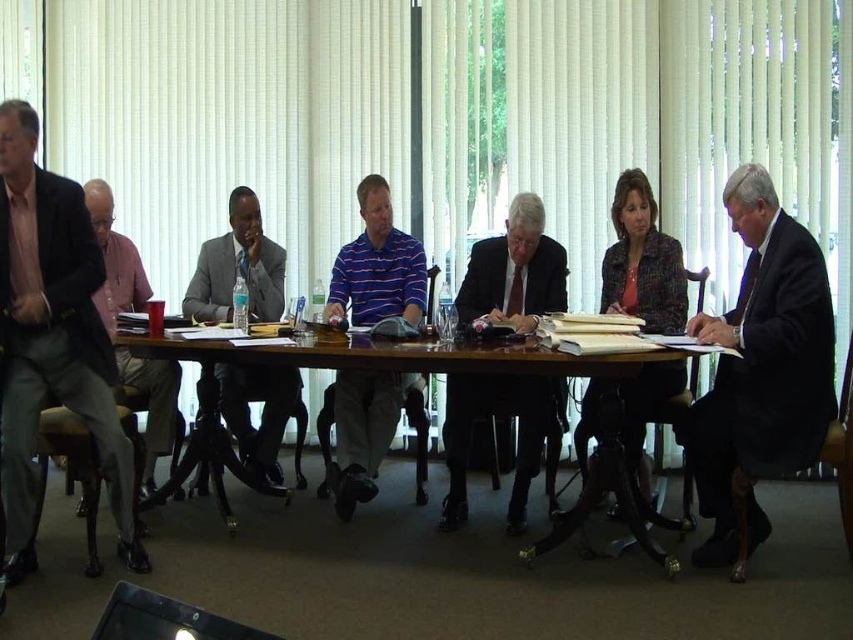
Question: Which point is farther to the camera?

Choices:
 (A) (251, 259)
 (B) (129, 552)
 (C) (659, 317)
 (D) (386, 429)

Answer: (A)

Question: Can you confirm if gray suit at center is smaller than patterned fabric blazer at center?

Choices:
 (A) no
 (B) yes

Answer: (B)

Question: Is light brown suit at left bigger than wooden table at center?

Choices:
 (A) no
 (B) yes

Answer: (A)

Question: Which of the following is the farthest from the observer?

Choices:
 (A) (398, 237)
 (B) (657, 296)
 (C) (778, 317)

Answer: (A)

Question: From the image, what is the correct spatial relationship of light brown suit at left in relation to dark suit at center?

Choices:
 (A) right
 (B) left

Answer: (B)

Question: Among these objects, which one is farthest from the camera?

Choices:
 (A) light brown suit at left
 (B) dark suit at center

Answer: (B)